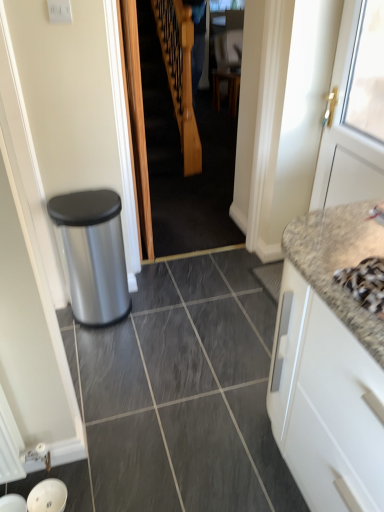
At what (x,y) coordinates should I click in order to perform the action: click on blank space above granite at right (from a real-world perspective). Please return your answer as a coordinate pair (x, y). The height and width of the screenshot is (512, 384). Looking at the image, I should click on (177, 371).